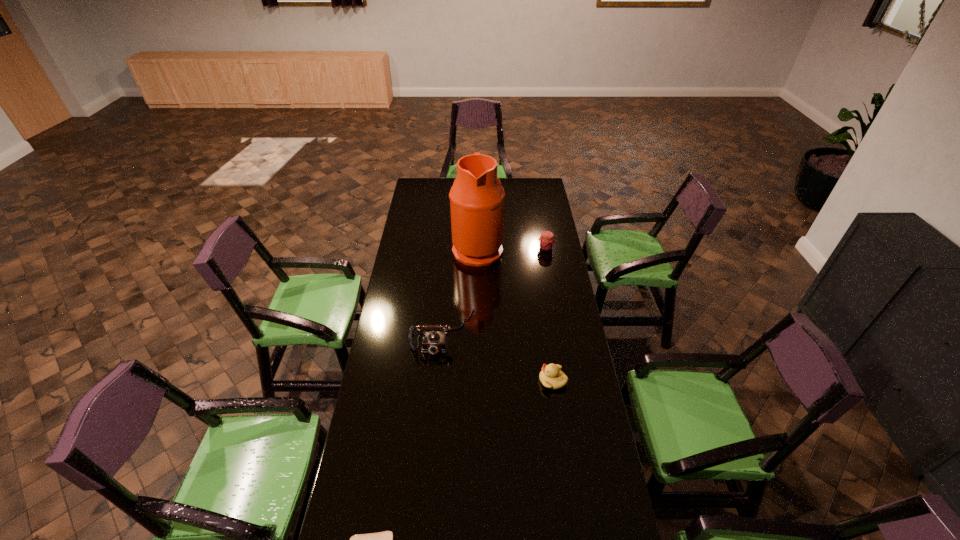
At what (x,y) coordinates should I click in order to perform the action: click on blank region between the jam and the duckling. Please return your answer as a coordinate pair (x, y). Looking at the image, I should click on (549, 315).

Where is `vacant point located between the jam and the tallest object`? The image size is (960, 540). vacant point located between the jam and the tallest object is located at coordinates (512, 248).

Locate an element on the screen. Image resolution: width=960 pixels, height=540 pixels. vacant point located between the third nearest object and the jam is located at coordinates (494, 291).

What are the coordinates of `the fourth closest object to the duckling` in the screenshot? It's located at (546, 241).

Choose which object is the third nearest neighbor to the third nearest object. Please provide its 2D coordinates. Your answer should be formatted as a tuple, i.e. [(x, y)], where the tuple contains the x and y coordinates of a point satisfying the conditions above.

[(546, 241)]

Find the location of a particular element. The image size is (960, 540). free space that satisfies the following two spatial constraints: 1. from the spout of the water jug; 2. on the dial of the telephone is located at coordinates (477, 332).

You are a GUI agent. You are given a task and a screenshot of the screen. Output one action in this format:
    pyautogui.click(x=<x>, y=<y>)
    Task: Click on the free spot that satisfies the following two spatial constraints: 1. from the spout of the water jug; 2. on the dial of the telephone
    The width and height of the screenshot is (960, 540).
    Given the screenshot: What is the action you would take?
    coord(477,332)

Image resolution: width=960 pixels, height=540 pixels. I want to click on vacant region that satisfies the following two spatial constraints: 1. on the back side of the jam; 2. from the spout of the tallest object, so click(545, 248).

At what (x,y) coordinates should I click in order to perform the action: click on vacant space that satisfies the following two spatial constraints: 1. from the spout of the jam; 2. on the right side of the water jug. Please return your answer as a coordinate pair (x, y). The image size is (960, 540). Looking at the image, I should click on (477, 248).

The width and height of the screenshot is (960, 540). I want to click on vacant space that satisfies the following two spatial constraints: 1. from the spout of the jam; 2. on the right side of the tallest object, so click(477, 248).